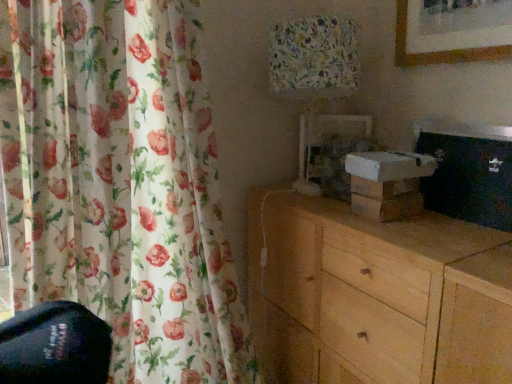
Question: Is light wood chest of drawers at lower right spatially inside floral fabric curtain at left, or outside of it?

Choices:
 (A) inside
 (B) outside

Answer: (B)

Question: In the image, is light wood chest of drawers at lower right on the left side or the right side of floral fabric curtain at left?

Choices:
 (A) left
 (B) right

Answer: (B)

Question: Considering the real-world distances, which object is closest to the light wood chest of drawers at lower right?

Choices:
 (A) floral fabric lampshade at upper center
 (B) floral fabric curtain at left

Answer: (A)

Question: Which object is positioned farthest from the light wood chest of drawers at lower right?

Choices:
 (A) floral fabric curtain at left
 (B) floral fabric lampshade at upper center

Answer: (A)